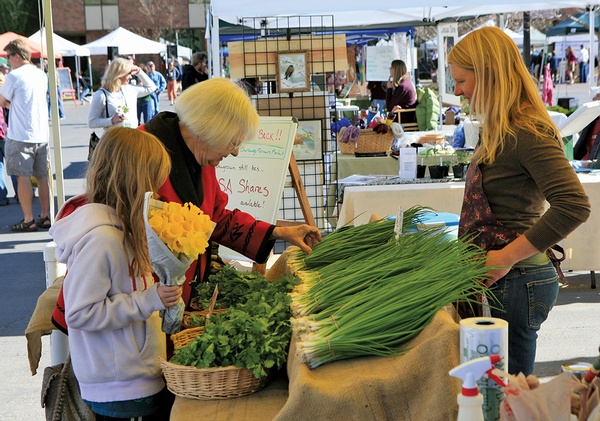
Locate an element on the screen. This screenshot has width=600, height=421. frames is located at coordinates (306, 121), (307, 72).